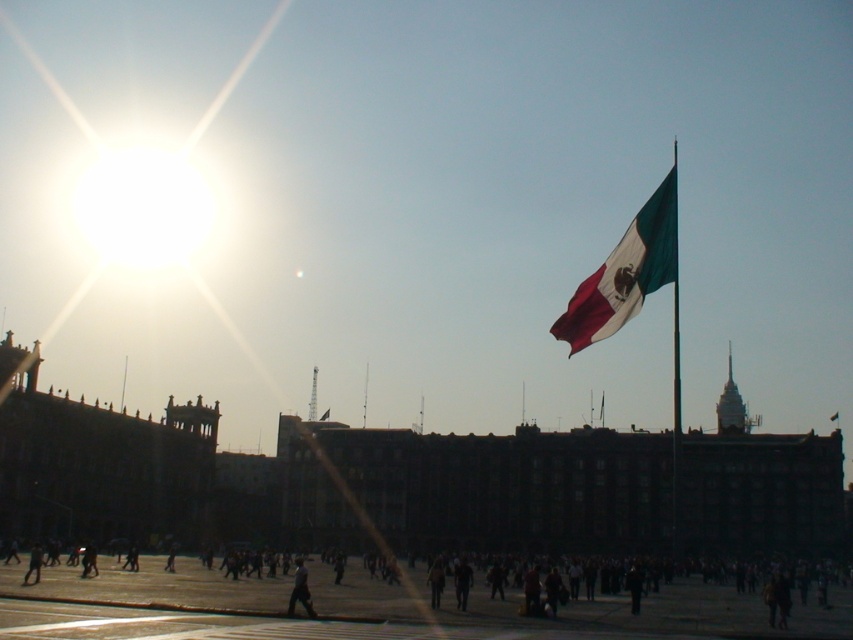
Question: Which object appears farthest from the camera in this image?

Choices:
 (A) dark clothing at center
 (B) textured cotton flag at upper right
 (C) dark gray fabric person at center

Answer: (C)

Question: Can you confirm if textured cotton flag at upper right is positioned below dark gray fabric person at center?

Choices:
 (A) no
 (B) yes

Answer: (A)

Question: Which object is the farthest from the dark gray fabric person at center?

Choices:
 (A) textured cotton flag at upper right
 (B) dark clothing at center

Answer: (A)

Question: From the image, what is the correct spatial relationship of dark clothing at center in relation to dark gray fabric person at center?

Choices:
 (A) left
 (B) right

Answer: (B)

Question: Estimate the real-world distances between objects in this image. Which object is closer to the dark clothing at center?

Choices:
 (A) dark gray fabric person at center
 (B) textured cotton flag at upper right

Answer: (A)

Question: In this image, where is dark clothing at center located relative to dark gray fabric person at center?

Choices:
 (A) below
 (B) above

Answer: (A)